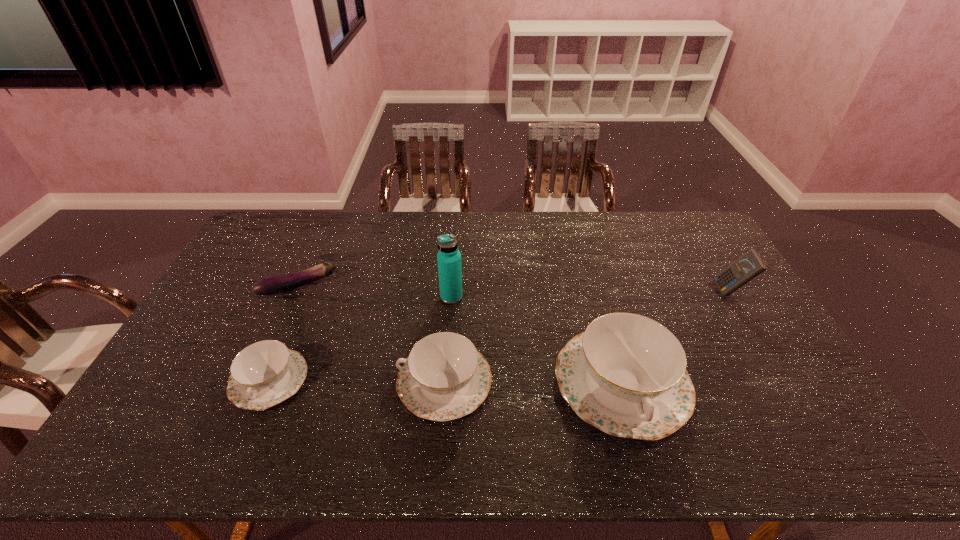
Locate an element on the screen. the leftmost chinaware is located at coordinates (263, 374).

I want to click on the second shortest object, so click(263, 374).

You are a GUI agent. You are given a task and a screenshot of the screen. Output one action in this format:
    pyautogui.click(x=<x>, y=<y>)
    Task: Click on the fourth tallest object
    The height and width of the screenshot is (540, 960).
    Given the screenshot: What is the action you would take?
    pyautogui.click(x=444, y=377)

Identify the location of the second chinaware from right to left. (444, 377).

Find the location of a particular element. the tallest chinaware is located at coordinates (626, 375).

I want to click on the fifth object from left to right, so pos(626,375).

Find the location of `the shortest object`. the shortest object is located at coordinates (278, 284).

Where is `the rightmost object`? the rightmost object is located at coordinates (750, 265).

Locate an element on the screen. water bottle is located at coordinates (449, 257).

This screenshot has height=540, width=960. Identify the location of vacant space located 0.090m on the handle side of the second chinaware from right to left. (364, 382).